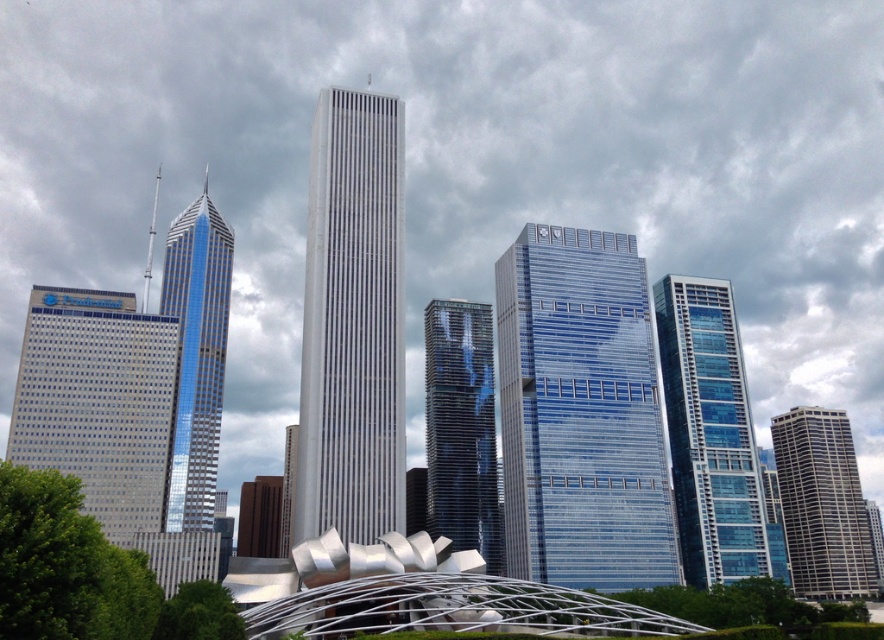
Question: Is reflective glass skyscraper at center to the left of shiny glass skyscraper at left from the viewer's perspective?

Choices:
 (A) yes
 (B) no

Answer: (B)

Question: Estimate the real-world distances between objects in this image. Which object is farther from the blue glass skyscraper at center?

Choices:
 (A) reflective glass skyscraper at center
 (B) white glass skyscraper at center
 (C) shiny glass skyscraper at left

Answer: (C)

Question: Is blue glass building at right smaller than gray marble skyscraper at right?

Choices:
 (A) no
 (B) yes

Answer: (B)

Question: Which object is farther from the camera taking this photo?

Choices:
 (A) shiny glass skyscraper at left
 (B) white glass skyscraper at center
 (C) gray marble skyscraper at right
 (D) blue glass skyscraper at center

Answer: (C)

Question: Among these points, which one is farthest from the camera?

Choices:
 (A) (688, 285)
 (B) (562, 269)
 (C) (382, 474)
 (D) (192, 400)

Answer: (A)

Question: Does blue glass skyscraper at center come in front of shiny glass skyscraper at left?

Choices:
 (A) no
 (B) yes

Answer: (A)